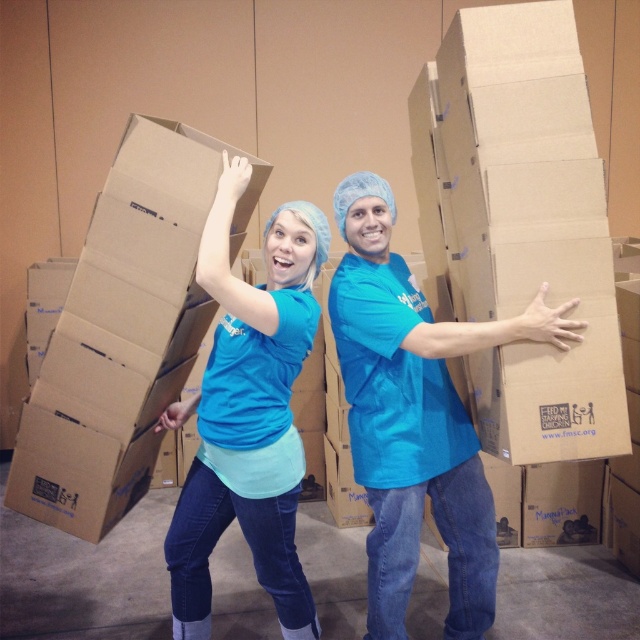
Who is lower down, brown cardboard box at right or blue fabric shirt at center?

Positioned lower is blue fabric shirt at center.

Does point (467, 388) come closer to viewer compared to point (483, 632)?

Yes, point (467, 388) is in front of point (483, 632).

Where is `brown cardboard box at right`? brown cardboard box at right is located at coordinates (518, 227).

Is brown cardboard box at right in front of matte blue shirt at center?

Yes, brown cardboard box at right is closer to the viewer.

Is point (490, 76) closer to camera compared to point (243, 179)?

Yes, point (490, 76) is in front of point (243, 179).

The image size is (640, 640). I want to click on brown cardboard box at right, so click(518, 227).

Between blue fabric shirt at center and matte blue shirt at center, which one appears on the right side from the viewer's perspective?

Positioned to the right is blue fabric shirt at center.

Where is `blue fabric shirt at center`? The image size is (640, 640). blue fabric shirt at center is located at coordinates (417, 419).

At what (x,y) coordinates should I click in order to perform the action: click on blue fabric shirt at center. Please return your answer as a coordinate pair (x, y). Image resolution: width=640 pixels, height=640 pixels. Looking at the image, I should click on (417, 419).